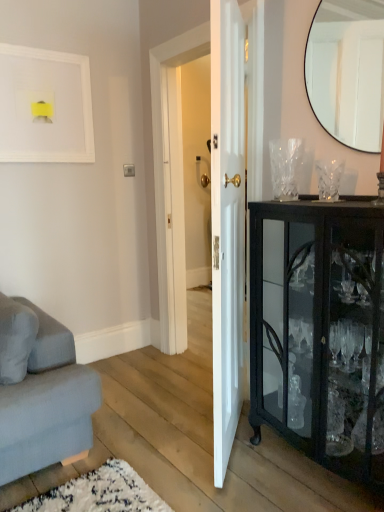
Question: Is matte black mirror at upper right taller than black glass cabinet at right?

Choices:
 (A) no
 (B) yes

Answer: (A)

Question: Is black glass cabinet at right a part of matte black mirror at upper right?

Choices:
 (A) no
 (B) yes

Answer: (A)

Question: Is matte black mirror at upper right behind black glass cabinet at right?

Choices:
 (A) no
 (B) yes

Answer: (B)

Question: From a real-world perspective, is matte black mirror at upper right over black glass cabinet at right?

Choices:
 (A) no
 (B) yes

Answer: (B)

Question: Can you confirm if matte black mirror at upper right is positioned to the left of black glass cabinet at right?

Choices:
 (A) yes
 (B) no

Answer: (B)

Question: From a real-world perspective, is white matte picture frame at upper left physically located above or below black glass cabinet at right?

Choices:
 (A) below
 (B) above

Answer: (B)

Question: From their relative heights in the image, would you say white matte picture frame at upper left is taller or shorter than black glass cabinet at right?

Choices:
 (A) tall
 (B) short

Answer: (B)

Question: Based on their sizes in the image, would you say white matte picture frame at upper left is bigger or smaller than black glass cabinet at right?

Choices:
 (A) big
 (B) small

Answer: (B)

Question: Is white matte picture frame at upper left in front of or behind black glass cabinet at right in the image?

Choices:
 (A) front
 (B) behind

Answer: (B)

Question: Relative to black glass cabinet at right, is matte black mirror at upper right in front or behind?

Choices:
 (A) behind
 (B) front

Answer: (A)

Question: From a real-world perspective, relative to black glass cabinet at right, is matte black mirror at upper right vertically above or below?

Choices:
 (A) above
 (B) below

Answer: (A)

Question: Does point (364, 116) appear closer or farther from the camera than point (344, 211)?

Choices:
 (A) farther
 (B) closer

Answer: (A)

Question: In terms of width, does matte black mirror at upper right look wider or thinner when compared to black glass cabinet at right?

Choices:
 (A) thin
 (B) wide

Answer: (A)

Question: From the image's perspective, is black glass cabinet at right above or below white glossy door at center?

Choices:
 (A) below
 (B) above

Answer: (A)

Question: Which is correct: black glass cabinet at right is inside white glossy door at center, or outside of it?

Choices:
 (A) inside
 (B) outside

Answer: (B)